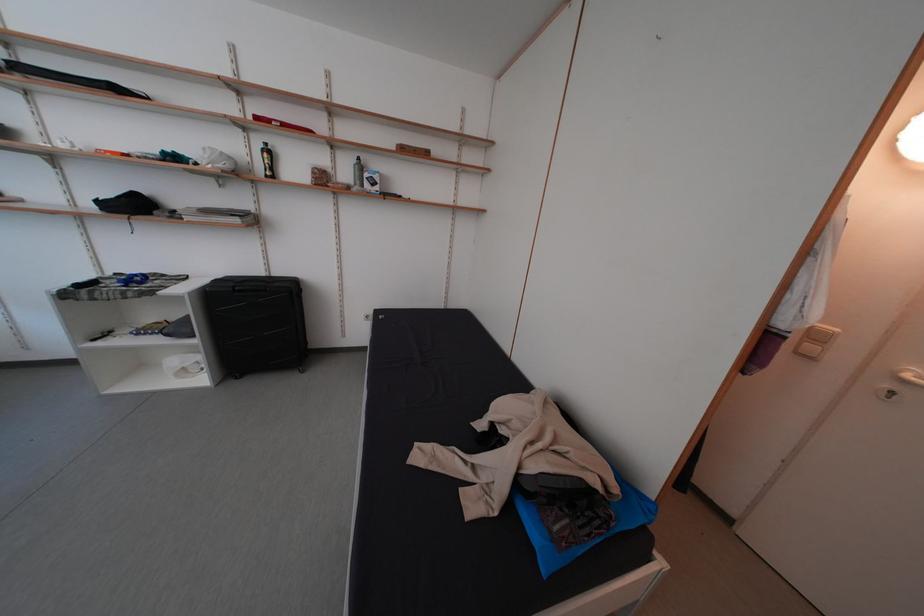
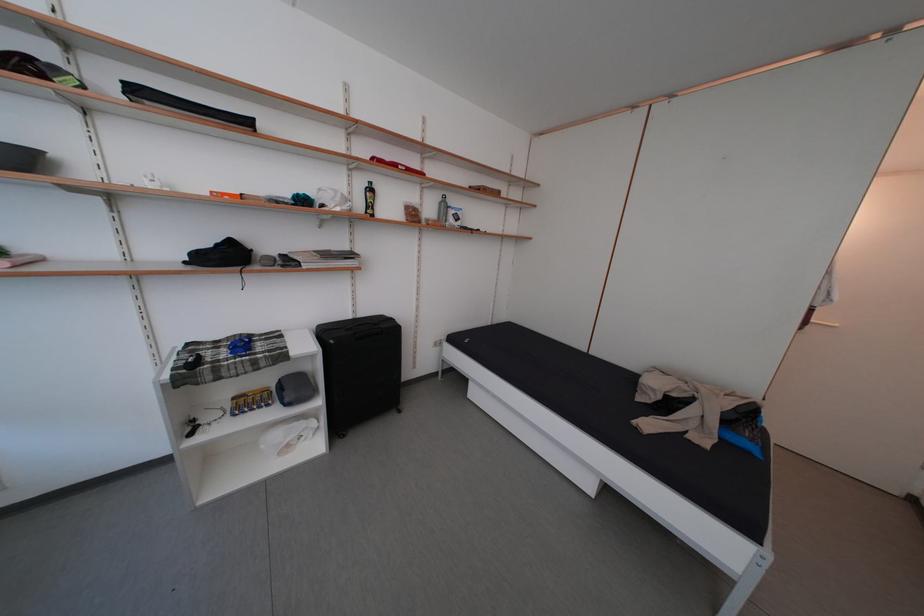
Question: Which direction would the cameraman need to move to produce the second image? Reply with the corresponding letter.

Choices:
 (A) Left
 (B) Right
 (C) Forward
 (D) Backward

Answer: (A)